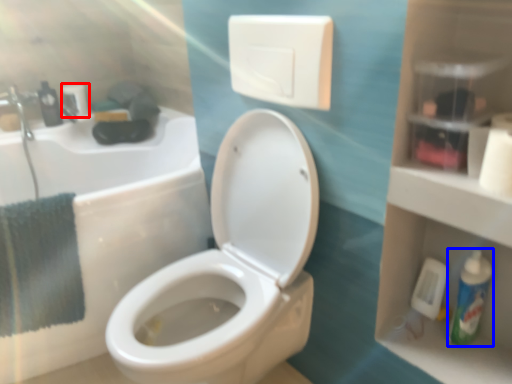
Question: Which object appears farthest to the camera in this image, toilet paper (highlighted by a red box) or mouthwash (highlighted by a blue box)?

Choices:
 (A) toilet paper
 (B) mouthwash

Answer: (A)